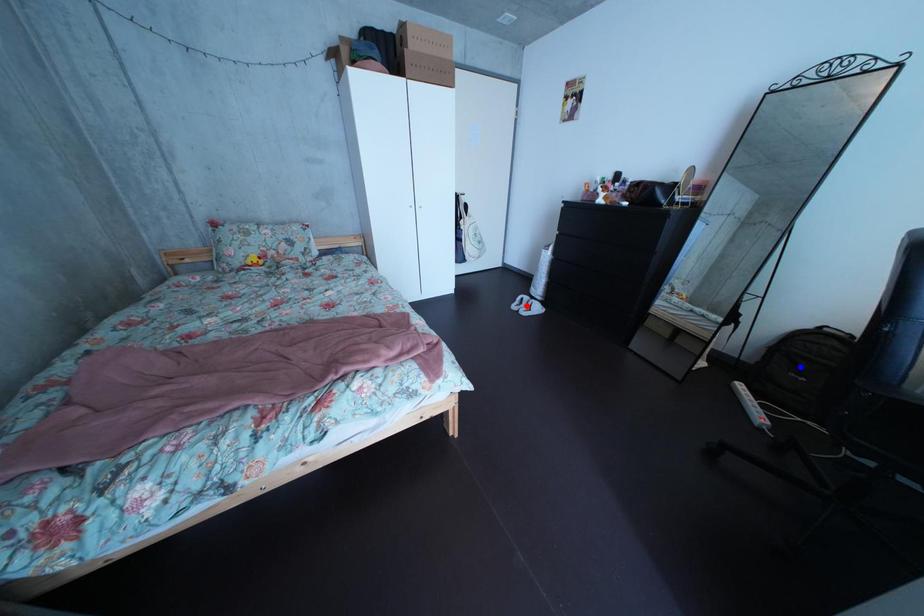
Question: Two points are marked on the image. Which point is closer to the camera?

Choices:
 (A) Blue point is closer.
 (B) Red point is closer.

Answer: (A)